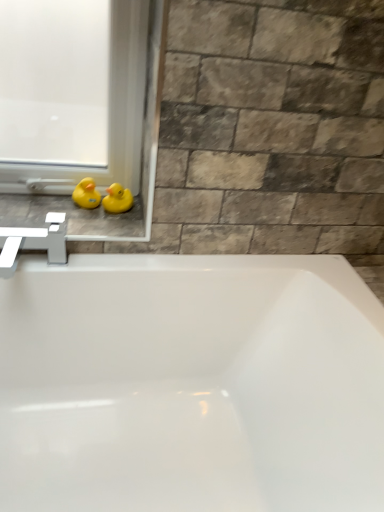
Question: In terms of height, does yellow rubber duck at left, which is the 2th duck in right-to-left order, look taller or shorter compared to white plastic window frame at lower left?

Choices:
 (A) short
 (B) tall

Answer: (A)

Question: Is yellow rubber duck at left, the 1th duck when ordered from left to right, wider or thinner than white plastic window frame at lower left?

Choices:
 (A) wide
 (B) thin

Answer: (B)

Question: Which of these objects is positioned farthest from the yellow rubber duck at upper left, the 2th duck in the left-to-right sequence?

Choices:
 (A) yellow rubber duck at left, the 1th duck when ordered from left to right
 (B) yellow rubber duck at left
 (C) white plastic window frame at lower left

Answer: (C)

Question: Which object is the closest to the yellow rubber duck at upper left, the first duck positioned from the right?

Choices:
 (A) white plastic window frame at lower left
 (B) yellow rubber duck at left
 (C) yellow rubber duck at left, which is the 2th duck in right-to-left order

Answer: (C)